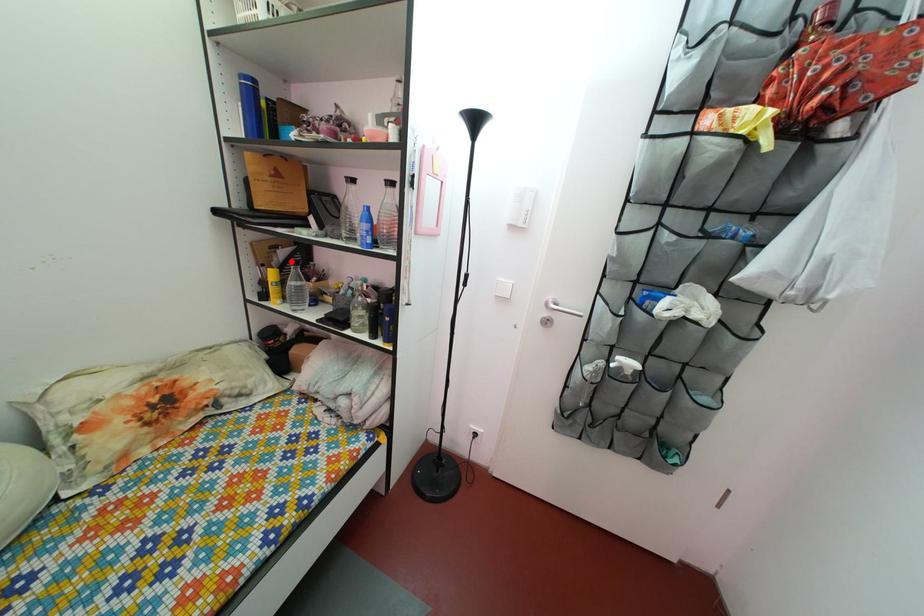
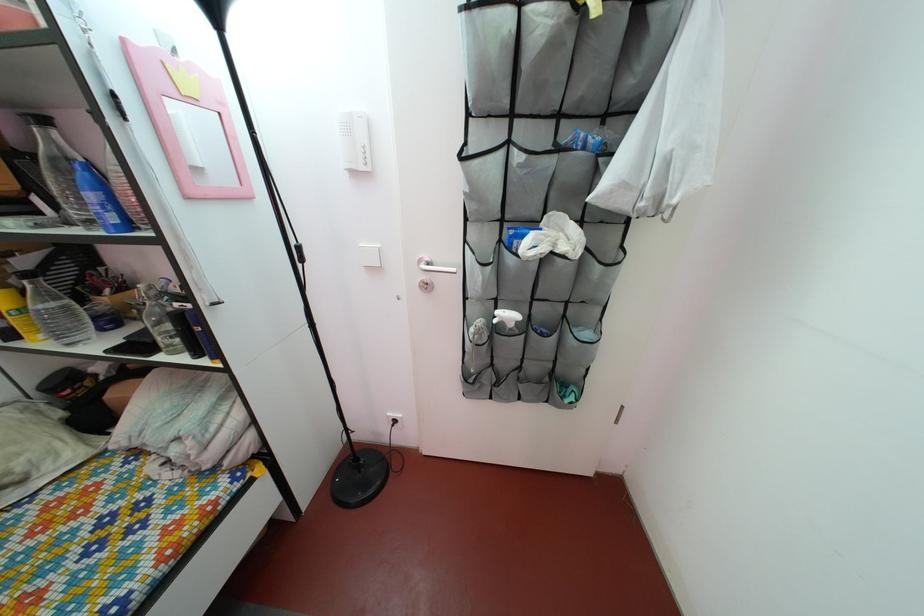
Question: I am providing you with two images of the same scene from different viewpoints. Image1 has a red point marked. In image2, the corresponding 3D location appears at what relative position? Reply with the corresponding letter.

Choices:
 (A) Closer
 (B) Farther

Answer: (B)